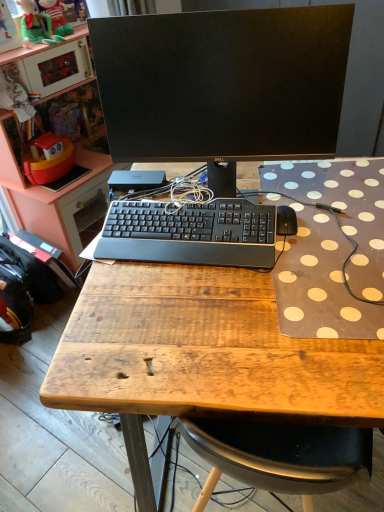
Question: Is the position of wooden desk at center more distant than that of black matte keyboard at center?

Choices:
 (A) yes
 (B) no

Answer: (B)

Question: From a real-world perspective, does wooden desk at center sit lower than black matte keyboard at center?

Choices:
 (A) no
 (B) yes

Answer: (B)

Question: Does wooden desk at center come in front of black matte keyboard at center?

Choices:
 (A) no
 (B) yes

Answer: (B)

Question: Does wooden desk at center have a larger size compared to black matte keyboard at center?

Choices:
 (A) no
 (B) yes

Answer: (B)

Question: Is wooden desk at center not inside black matte keyboard at center?

Choices:
 (A) no
 (B) yes

Answer: (B)

Question: Is wooden desk at center to the left of black matte keyboard at center from the viewer's perspective?

Choices:
 (A) no
 (B) yes

Answer: (A)

Question: From the image's perspective, is black matte monitor at center located beneath wooden desk at center?

Choices:
 (A) no
 (B) yes

Answer: (A)

Question: From a real-world perspective, is black matte monitor at center beneath wooden desk at center?

Choices:
 (A) yes
 (B) no

Answer: (B)

Question: Is black matte monitor at center thinner than wooden desk at center?

Choices:
 (A) yes
 (B) no

Answer: (A)

Question: Does black matte monitor at center have a lesser height compared to wooden desk at center?

Choices:
 (A) no
 (B) yes

Answer: (B)

Question: Considering the relative positions of black matte monitor at center and wooden desk at center in the image provided, is black matte monitor at center to the right of wooden desk at center from the viewer's perspective?

Choices:
 (A) no
 (B) yes

Answer: (A)

Question: From the image's perspective, is black matte monitor at center located above wooden desk at center?

Choices:
 (A) no
 (B) yes

Answer: (B)

Question: From a real-world perspective, is black matte monitor at center below black fabric backpack at lower left, acting as the second backpack starting from the front?

Choices:
 (A) yes
 (B) no

Answer: (B)